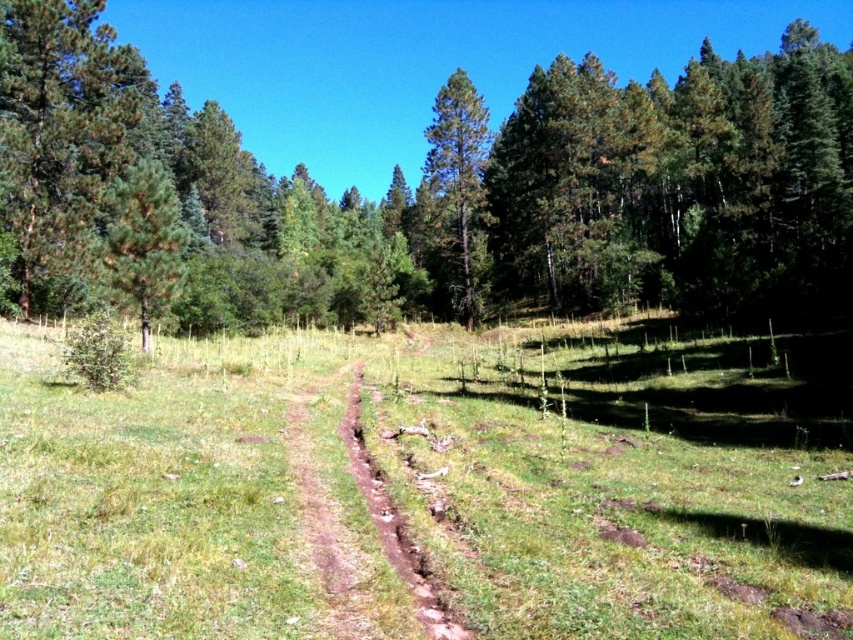
Question: Is green grassy at center positioned before green matte tree at center?

Choices:
 (A) yes
 (B) no

Answer: (A)

Question: Which object is the farthest from the green grassy at center?

Choices:
 (A) green leafy forest at center
 (B) green matte tree at center

Answer: (A)

Question: Which of the following is the farthest from the observer?

Choices:
 (A) (445, 125)
 (B) (274, 605)

Answer: (A)

Question: Does green grassy at center come behind green matte tree at center?

Choices:
 (A) no
 (B) yes

Answer: (A)

Question: In this image, where is green grassy at center located relative to green leafy forest at center?

Choices:
 (A) left
 (B) right

Answer: (A)

Question: Which of the following is the closest to the observer?

Choices:
 (A) (106, 484)
 (B) (259, 300)
 (C) (465, 276)

Answer: (A)